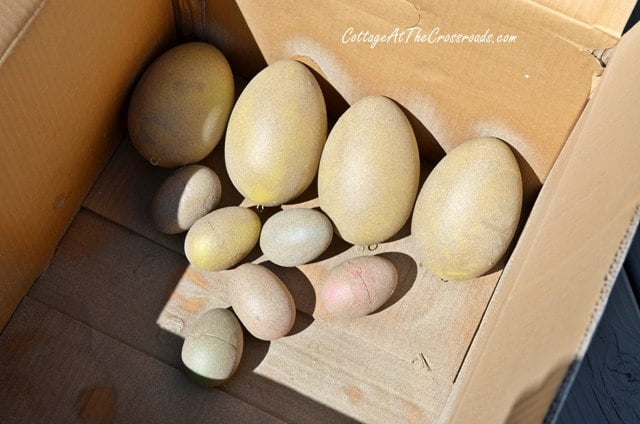
Where is `wooden table`? wooden table is located at coordinates (600, 384).